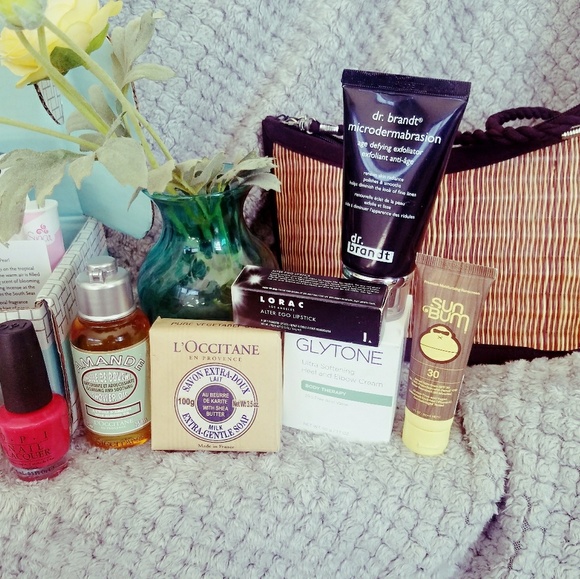
This screenshot has height=579, width=580. Find the location of `blanket`. blanket is located at coordinates (378, 39).